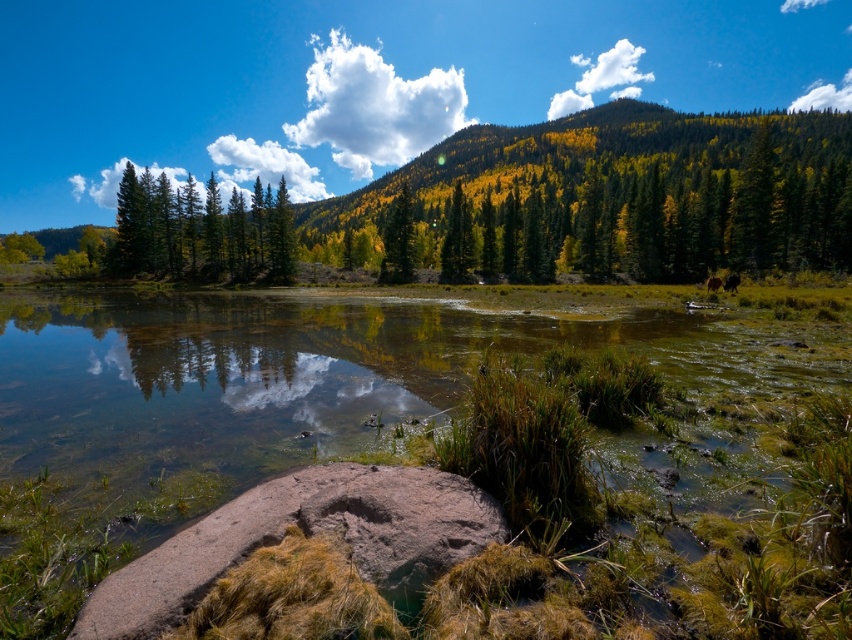
Between brown rough rock at center and brown furry dog at lower right, which one appears on the left side from the viewer's perspective?

Positioned to the left is brown rough rock at center.

Between point (173, 538) and point (711, 282), which one is positioned in front?

Point (173, 538) is in front.

The width and height of the screenshot is (852, 640). Identify the location of brown rough rock at center. (306, 532).

Can you confirm if golden-green foliage at upper center is shorter than brown furry bear at right?

No.

Is golden-green foliage at upper center to the left of brown furry bear at right from the viewer's perspective?

In fact, golden-green foliage at upper center is to the right of brown furry bear at right.

Is point (734, 138) positioned in front of point (735, 280)?

No.

Image resolution: width=852 pixels, height=640 pixels. In order to click on golden-green foliage at upper center in this screenshot , I will do `click(620, 195)`.

Describe the element at coordinates (556, 520) in the screenshot. I see `clear water at center` at that location.

Is clear water at center thinner than yellow-green foliage at center?

No.

Identify the location of clear water at center. The width and height of the screenshot is (852, 640). (556, 520).

Identify the location of clear water at center. (556, 520).